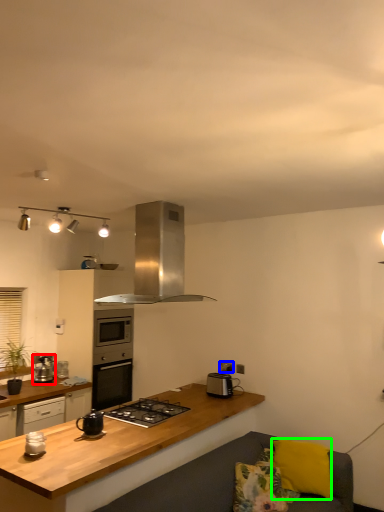
Question: Which object is positioned farthest from kitchen appliance (highlighted by a red box)? Select from electric outlet (highlighted by a blue box) and pillow (highlighted by a green box).

Choices:
 (A) electric outlet
 (B) pillow

Answer: (B)